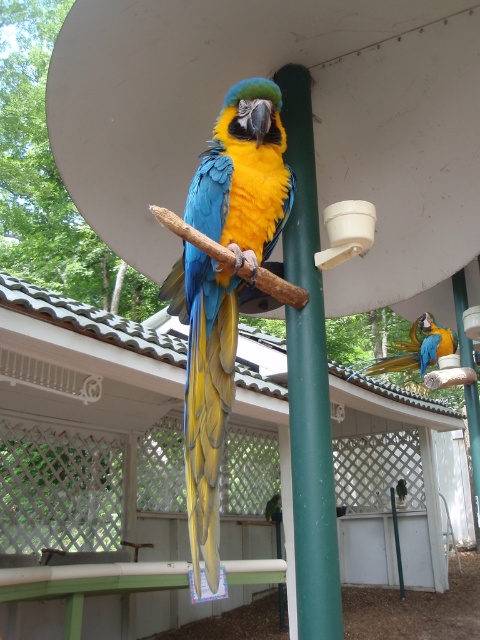
Does shiny blue-green parrot at center have a larger size compared to green matte pole at center?

Yes.

Is shiny blue-green parrot at center positioned at the back of green matte pole at center?

No, it is in front of green matte pole at center.

Describe the element at coordinates (224, 284) in the screenshot. I see `shiny blue-green parrot at center` at that location.

Find the location of a particular element. This screenshot has height=640, width=480. shiny blue-green parrot at center is located at coordinates (224, 284).

Is point (333, 506) positioned before point (399, 365)?

That is True.

Which of these two, green matte pole at center or blue glossy parrot at center, stands taller?

green matte pole at center

Locate an element on the screen. This screenshot has width=480, height=640. green matte pole at center is located at coordinates (309, 380).

This screenshot has height=640, width=480. I want to click on shiny blue-green parrot at center, so click(x=224, y=284).

From the picture: Who is taller, shiny blue-green parrot at center or blue glossy parrot at center?

Standing taller between the two is shiny blue-green parrot at center.

Which is behind, point (176, 308) or point (418, 349)?

Point (418, 349)

Identify the location of shiny blue-green parrot at center. The image size is (480, 640). (224, 284).